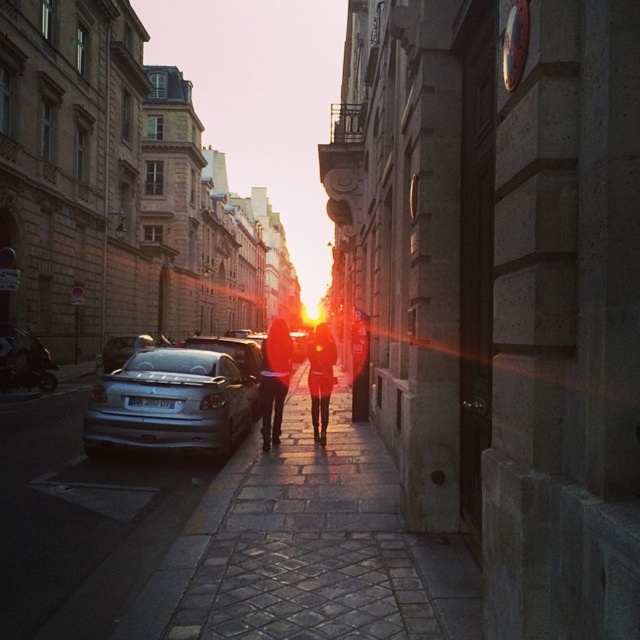
Does silver metallic car at left appear on the right side of matte black jacket at center?

No, silver metallic car at left is not to the right of matte black jacket at center.

Does silver metallic car at left have a greater height compared to matte black jacket at center?

No.

Does point (156, 419) lie in front of point (276, 340)?

Yes, it is.

The width and height of the screenshot is (640, 640). I want to click on silver metallic car at left, so click(172, 403).

Which is more to the right, cobblestone pavement at center or matte black jacket at center?

Positioned to the right is cobblestone pavement at center.

Where is `cobblestone pavement at center`? cobblestone pavement at center is located at coordinates (314, 548).

Looking at this image, between matte black jacket at center and matte black dress at center, which one appears on the left side from the viewer's perspective?

matte black jacket at center

What do you see at coordinates (275, 380) in the screenshot? I see `matte black jacket at center` at bounding box center [275, 380].

Which is in front, point (284, 323) or point (326, 340)?

Point (284, 323) is more forward.

You are a GUI agent. You are given a task and a screenshot of the screen. Output one action in this format:
    pyautogui.click(x=<x>, y=<y>)
    Task: Click on the matte black jacket at center
    The height and width of the screenshot is (640, 640).
    Given the screenshot: What is the action you would take?
    pyautogui.click(x=275, y=380)